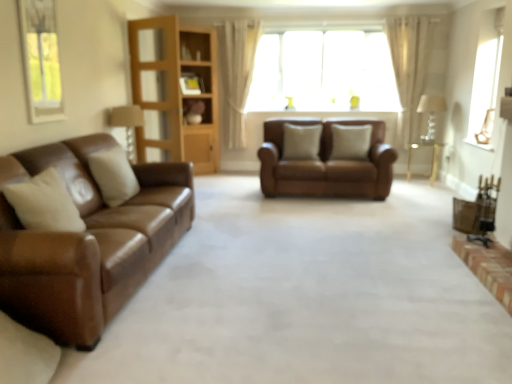
Locate an element on the screen. translucent fabric window at center, the first window viewed from the back is located at coordinates (323, 72).

The width and height of the screenshot is (512, 384). Describe the element at coordinates (88, 242) in the screenshot. I see `brown leather couch at left, arranged as the 1th studio couch when viewed from the left` at that location.

Where is `beige fabric curtain at upper center, the second curtain in the left-to-right sequence`? beige fabric curtain at upper center, the second curtain in the left-to-right sequence is located at coordinates (413, 64).

The width and height of the screenshot is (512, 384). Find the location of `gold metallic table at right`. gold metallic table at right is located at coordinates (432, 158).

Where is `translucent fabric window at center, the 2th window when ordered from right to left`? translucent fabric window at center, the 2th window when ordered from right to left is located at coordinates (323, 72).

Between matte wooden lamp at left, which appears as the 1th lamp when viewed from the front, and gold metallic table at right, which one has more height?

matte wooden lamp at left, which appears as the 1th lamp when viewed from the front.

Which object is closer to the camera taking this photo, matte wooden lamp at left, which appears as the 1th lamp when viewed from the front, or gold metallic table at right?

Positioned in front is matte wooden lamp at left, which appears as the 1th lamp when viewed from the front.

From the image's perspective, which is above, matte wooden lamp at left, the second lamp in the back-to-front sequence, or gold metallic table at right?

matte wooden lamp at left, the second lamp in the back-to-front sequence, appears higher in the image.

Which of these two, matte wooden lamp at left, which appears as the 1th lamp when viewed from the front, or gold metallic table at right, is smaller?

matte wooden lamp at left, which appears as the 1th lamp when viewed from the front.

Could you measure the distance between translucent fabric window at center, the first window viewed from the back, and metallic gold chair at lower right?

translucent fabric window at center, the first window viewed from the back, is 10.53 feet away from metallic gold chair at lower right.

Between point (260, 63) and point (479, 188), which one is positioned behind?

The point (260, 63) is farther from the camera.

I want to click on the 2nd window positioned above the metallic gold chair at lower right (from the image's perspective), so click(323, 72).

From the image's perspective, which one is positioned higher, translucent fabric window at center, the first window when ordered from left to right, or metallic gold chair at lower right?

From the image's view, translucent fabric window at center, the first window when ordered from left to right, is above.

The width and height of the screenshot is (512, 384). In order to click on bookshelf in front of the gold metallic table at right in this screenshot , I will do `click(175, 92)`.

Is wooden bookshelf at center at the right side of gold metallic table at right?

Incorrect, wooden bookshelf at center is not on the right side of gold metallic table at right.

From a real-world perspective, is wooden bookshelf at center located beneath gold metallic table at right?

No, from a real-world perspective, wooden bookshelf at center is not under gold metallic table at right.

In the scene shown: Can you tell me how much brown leather couch at left, the second studio couch positioned from the right, and matte wooden lamp at left, the second lamp in the back-to-front sequence, differ in facing direction?

brown leather couch at left, the second studio couch positioned from the right, and matte wooden lamp at left, the second lamp in the back-to-front sequence, are facing 0.000652 degrees away from each other.

Could you measure the distance between brown leather couch at left, arranged as the 1th studio couch when viewed from the left, and matte wooden lamp at left, the second lamp in the back-to-front sequence?

They are 1.57 meters apart.

Is brown leather couch at left, arranged as the 1th studio couch when viewed from the left, shorter than matte wooden lamp at left, which appears as the 1th lamp when viewed from the front?

In fact, brown leather couch at left, arranged as the 1th studio couch when viewed from the left, may be taller than matte wooden lamp at left, which appears as the 1th lamp when viewed from the front.

Considering the positions of objects brown leather couch at left, the 1th studio couch viewed from the front, and matte wooden lamp at left, which ranks as the 1th lamp in left-to-right order, in the image provided, who is more to the right, brown leather couch at left, the 1th studio couch viewed from the front, or matte wooden lamp at left, which ranks as the 1th lamp in left-to-right order,?

Positioned to the right is brown leather couch at left, the 1th studio couch viewed from the front.

Where is `the 2nd window counting from the right side of the matte wooden lamp at left, which appears as the 1th lamp when viewed from the front`? This screenshot has width=512, height=384. the 2nd window counting from the right side of the matte wooden lamp at left, which appears as the 1th lamp when viewed from the front is located at coordinates (486, 80).

Consider the image. Does clear glass window at upper right, marked as the first window in a right-to-left arrangement, have a greater width compared to matte wooden lamp at left, the second lamp in the back-to-front sequence?

No.

Is clear glass window at upper right, which is counted as the 2th window, starting from the back, smaller than matte wooden lamp at left, the second lamp in the right-to-left sequence?

Incorrect, clear glass window at upper right, which is counted as the 2th window, starting from the back, is not smaller in size than matte wooden lamp at left, the second lamp in the right-to-left sequence.

Is point (493, 59) closer to viewer compared to point (134, 107)?

That is False.

From the image's perspective, who appears lower, beige fabric pillow at center, which is counted as the second pillow, starting from the right, or beige fabric curtain at upper center, the second curtain in the left-to-right sequence?

beige fabric pillow at center, which is counted as the second pillow, starting from the right, appears lower in the image.

Does point (311, 152) come behind point (390, 50)?

No, it is in front of (390, 50).

How different are the orientations of beige fabric pillow at center, which ranks as the 3th pillow in front-to-back order, and beige fabric curtain at upper center, the 1th curtain when ordered from right to left, in degrees?

The angular difference between beige fabric pillow at center, which ranks as the 3th pillow in front-to-back order, and beige fabric curtain at upper center, the 1th curtain when ordered from right to left, is 0.000633 degrees.

Which of these two, white sheer curtain at upper center, the 1th curtain viewed from the left, or beige fabric pillow at center, arranged as the second pillow when viewed from the left, stands taller?

white sheer curtain at upper center, the 1th curtain viewed from the left, is taller.

From a real-world perspective, does white sheer curtain at upper center, the 1th curtain viewed from the left, stand above beige fabric pillow at center, arranged as the second pillow when viewed from the left?

Yes, from a real-world perspective, white sheer curtain at upper center, the 1th curtain viewed from the left, is over beige fabric pillow at center, arranged as the second pillow when viewed from the left

Considering the relative sizes of white sheer curtain at upper center, the 1th curtain viewed from the left, and beige fabric pillow at center, which is counted as the second pillow, starting from the right, in the image provided, is white sheer curtain at upper center, the 1th curtain viewed from the left, bigger than beige fabric pillow at center, which is counted as the second pillow, starting from the right,?

Yes.

Is white sheer curtain at upper center, the 1th curtain viewed from the left, far away from beige fabric pillow at center, which is counted as the second pillow, starting from the right?

Yes, white sheer curtain at upper center, the 1th curtain viewed from the left, and beige fabric pillow at center, which is counted as the second pillow, starting from the right, are quite far apart.

Image resolution: width=512 pixels, height=384 pixels. There is a gold metallic table at right. In order to click on the 1st lamp above it (from the image's perspective) in this screenshot , I will do `click(127, 124)`.

Where is `chair in front of the translucent fabric window at center, which appears as the second window when viewed from the front`? chair in front of the translucent fabric window at center, which appears as the second window when viewed from the front is located at coordinates (485, 210).

Which object lies nearer to the anchor point beige fabric curtain at upper center, the 1th curtain when ordered from right to left, translucent glass lampshade at upper right, acting as the first lamp starting from the right, or wooden bookshelf at center?

translucent glass lampshade at upper right, acting as the first lamp starting from the right.

Which object lies nearer to the anchor point white sheer curtain at upper center, arranged as the 2th curtain when viewed from the right, wooden bookshelf at center or beige fabric curtain at upper center, the 1th curtain when ordered from right to left?

Among the two, wooden bookshelf at center is located nearer to white sheer curtain at upper center, arranged as the 2th curtain when viewed from the right.

From the image, which object appears to be farther from beige fabric pillow at center, the 3th pillow viewed from the left, beige leather pillow at left, placed as the third pillow when sorted from right to left, or beige fabric curtain at upper center, the second curtain in the left-to-right sequence?

The object further to beige fabric pillow at center, the 3th pillow viewed from the left, is beige leather pillow at left, placed as the third pillow when sorted from right to left.

Considering their positions, is metallic gold chair at lower right positioned closer to translucent fabric window at center, the first window when ordered from left to right, than clear glass window at upper right, placed as the second window when sorted from left to right?

clear glass window at upper right, placed as the second window when sorted from left to right, is closer to translucent fabric window at center, the first window when ordered from left to right.

From the image, which object appears to be nearer to beige leather pillow at left, the first pillow from the left, brown leather couch at left, the second studio couch positioned from the right, or gold metallic table at right?

brown leather couch at left, the second studio couch positioned from the right.

Looking at this image, which object lies further to the anchor point translucent glass lampshade at upper right, the second lamp from the front, metallic gold chair at lower right or white sheer curtain at upper center, the 1th curtain viewed from the left?

white sheer curtain at upper center, the 1th curtain viewed from the left.

Considering their positions, is matte wooden lamp at left, the second lamp in the right-to-left sequence, positioned further to beige fabric pillow at center, arranged as the second pillow when viewed from the left, than wooden bookshelf at center?

Among the two, matte wooden lamp at left, the second lamp in the right-to-left sequence, is located further to beige fabric pillow at center, arranged as the second pillow when viewed from the left.

When comparing their distances from brown leather couch at left, the second studio couch positioned from the right, does beige fabric pillow at center, which is counted as the second pillow, starting from the right, or translucent fabric window at center, which appears as the second window when viewed from the front, seem closer?

The object closer to brown leather couch at left, the second studio couch positioned from the right, is beige fabric pillow at center, which is counted as the second pillow, starting from the right.

At what (x,y) coordinates should I click in order to perform the action: click on window between matte wooden lamp at left, which ranks as the 1th lamp in left-to-right order, and gold metallic table at right from left to right. Please return your answer as a coordinate pair (x, y). The image size is (512, 384). Looking at the image, I should click on (323, 72).

Identify the location of chair between wooden bookshelf at center and translucent glass lampshade at upper right, positioned as the 1th lamp in back-to-front order, in the horizontal direction. This screenshot has width=512, height=384. (485, 210).

Find the location of `studio couch between metallic gold chair at lower right and beige fabric pillow at center, the 2th pillow viewed from the front, from front to back`. studio couch between metallic gold chair at lower right and beige fabric pillow at center, the 2th pillow viewed from the front, from front to back is located at coordinates (326, 164).

Locate an element on the screen. chair located between matte wooden lamp at left, which appears as the 1th lamp when viewed from the front, and translucent glass lampshade at upper right, acting as the first lamp starting from the right, in the left-right direction is located at coordinates (485, 210).